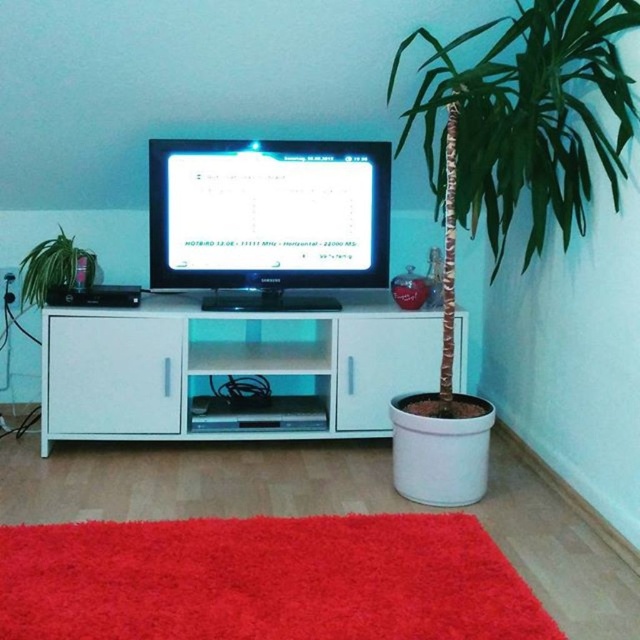
Question: Which point appears farthest from the camera in this image?

Choices:
 (A) (161, 339)
 (B) (189, 195)
 (C) (36, 273)

Answer: (B)

Question: Can you confirm if white glossy cabinet at center is positioned to the right of green matte plant at left?

Choices:
 (A) no
 (B) yes

Answer: (B)

Question: Can you confirm if white glossy cabinet at center is positioned below green matte plant at left?

Choices:
 (A) no
 (B) yes

Answer: (B)

Question: Estimate the real-world distances between objects in this image. Which object is closer to the white glossy cabinet at center?

Choices:
 (A) matte black monitor at center
 (B) green matte plant at left

Answer: (A)

Question: Can you confirm if matte black monitor at center is positioned below green matte plant at left?

Choices:
 (A) yes
 (B) no

Answer: (B)

Question: Which object is farther from the camera taking this photo?

Choices:
 (A) green matte plant at left
 (B) matte black monitor at center

Answer: (B)